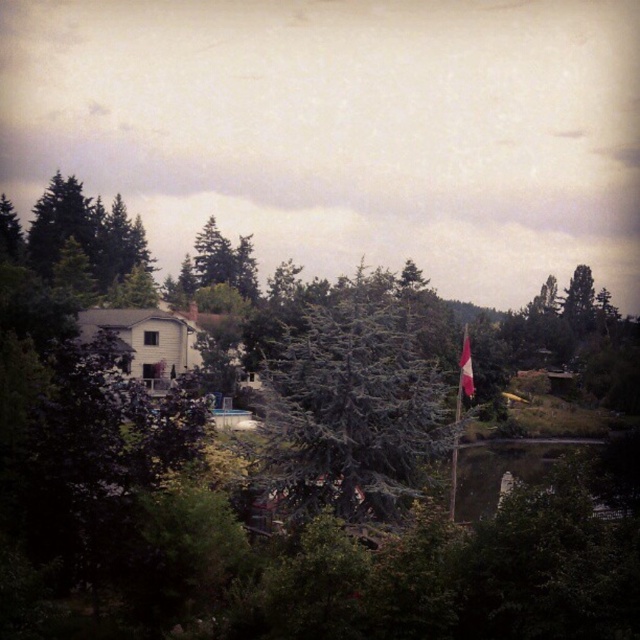
Consider the image. Which of these two, clear water at lower center or metallic flag pole at center-right, stands taller?

metallic flag pole at center-right is taller.

Between clear water at lower center and metallic flag pole at center-right, which one has less height?

With less height is clear water at lower center.

Who is more forward, (529, 467) or (452, 444)?

Point (452, 444)

Locate an element on the screen. The width and height of the screenshot is (640, 640). clear water at lower center is located at coordinates tap(504, 468).

Who is higher up, green needle-like tree at center or red fabric flag at center-right?

green needle-like tree at center is above.

Looking at this image, does green needle-like tree at center have a lesser width compared to red fabric flag at center-right?

No.

Between point (355, 394) and point (465, 326), which one is positioned in front?

Point (355, 394) is more forward.

This screenshot has width=640, height=640. What are the coordinates of `green needle-like tree at center` in the screenshot? It's located at (353, 401).

Which of these two, metallic flag pole at center-right or red fabric flag at center-right, stands taller?

With more height is metallic flag pole at center-right.

What do you see at coordinates (460, 412) in the screenshot? This screenshot has height=640, width=640. I see `metallic flag pole at center-right` at bounding box center [460, 412].

The image size is (640, 640). What are the coordinates of `metallic flag pole at center-right` in the screenshot? It's located at (460, 412).